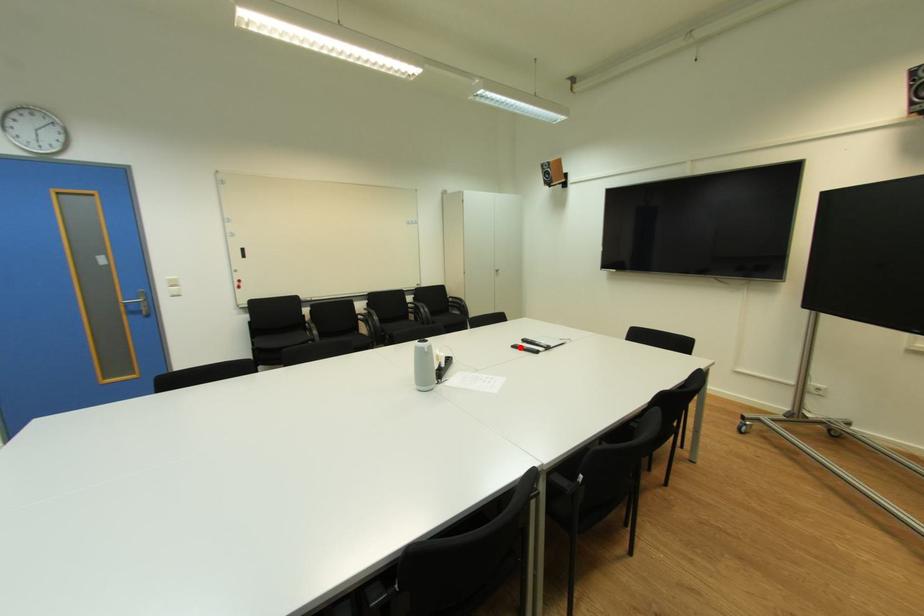
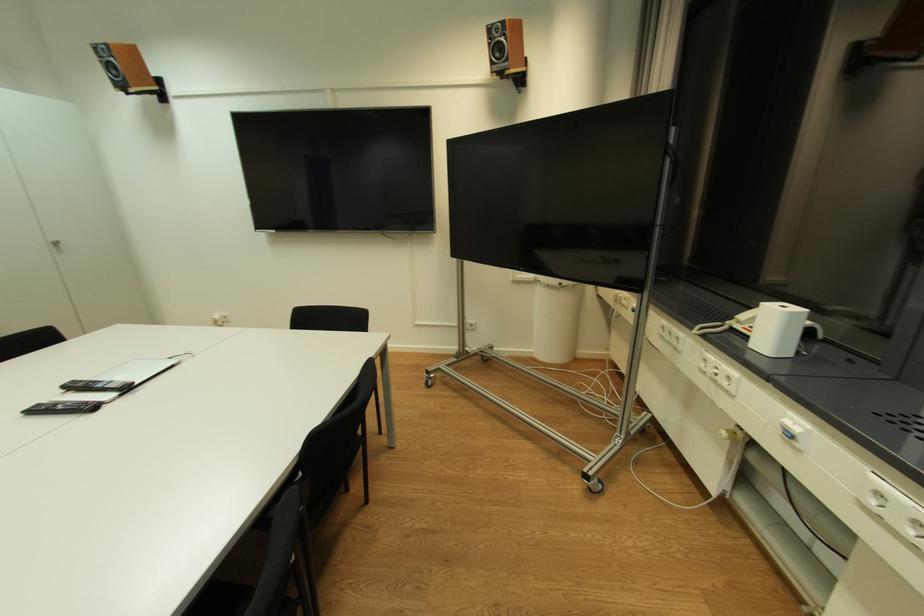
Locate, in the second image, the point that corresponds to the highlighted location in the first image.

(43, 411)